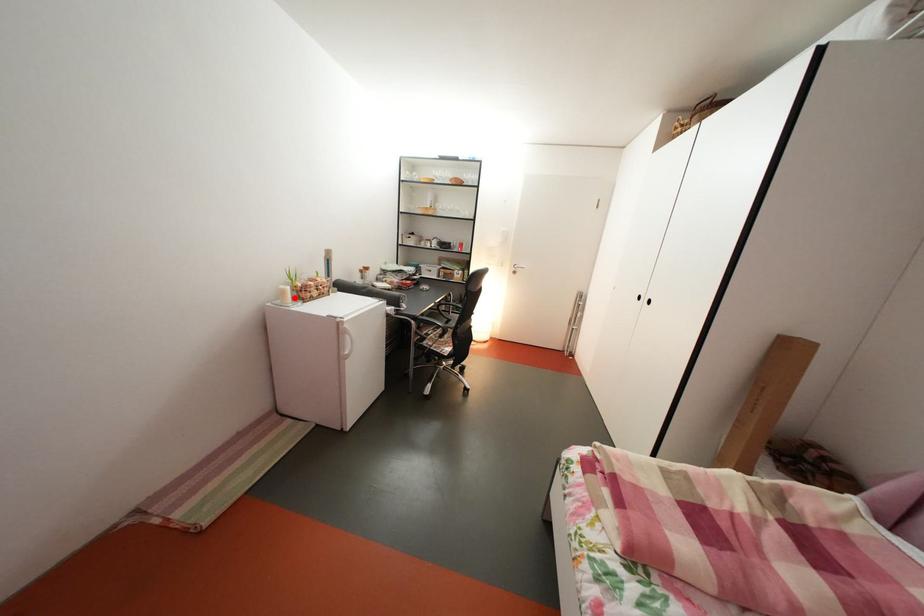
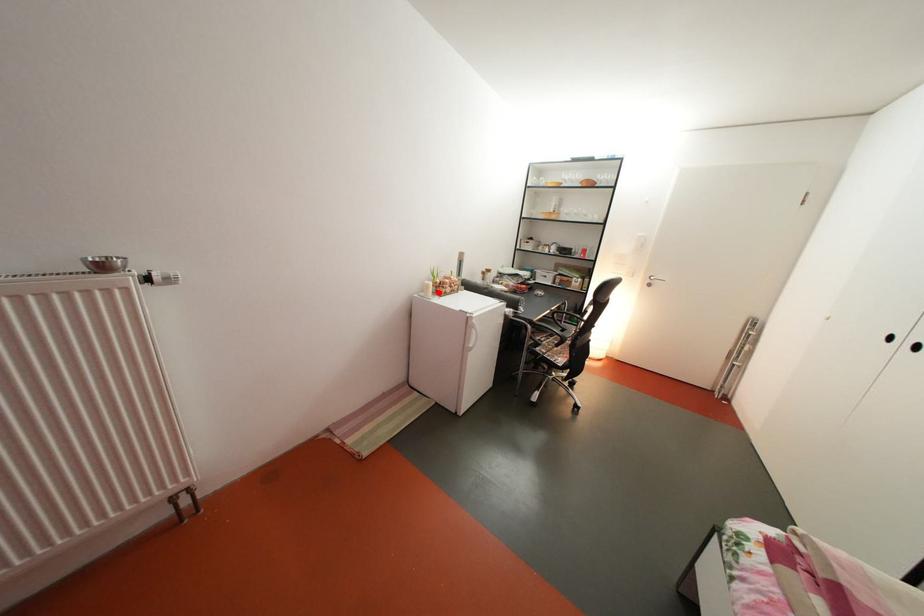
I am providing you with two images of the same scene from different viewpoints. A red point is marked on the first image and another point is marked on the second image. Does the point marked in image1 correspond to the same location as the one in image2?

Yes